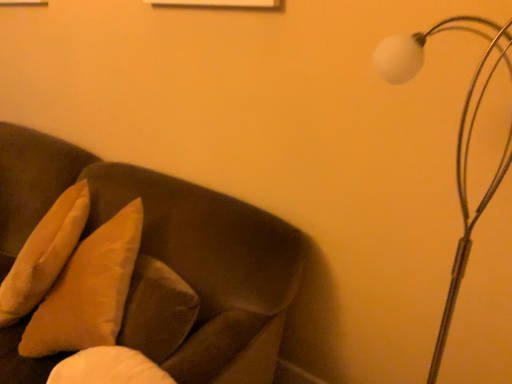
Question: From a real-world perspective, relative to soft beige pillow at left, is white matte lamp at upper right vertically above or below?

Choices:
 (A) below
 (B) above

Answer: (B)

Question: From the image's perspective, is white matte lamp at upper right above or below soft beige pillow at left?

Choices:
 (A) above
 (B) below

Answer: (B)

Question: Which object is positioned closest to the suede-like brown couch at left?

Choices:
 (A) soft beige pillow at left
 (B) white matte lamp at upper right

Answer: (A)

Question: Based on their relative distances, which object is nearer to the soft beige pillow at left?

Choices:
 (A) white matte lamp at upper right
 (B) suede-like brown couch at left

Answer: (B)